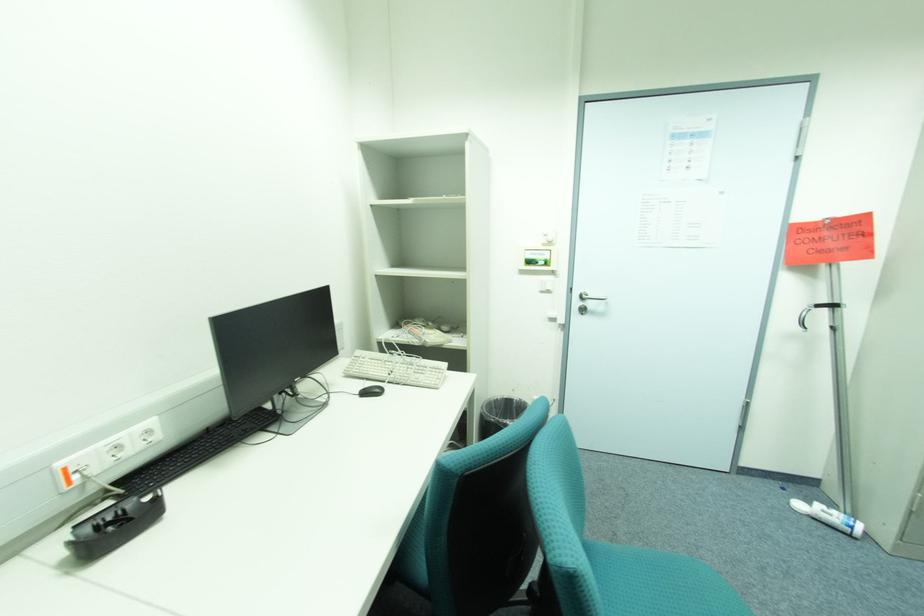
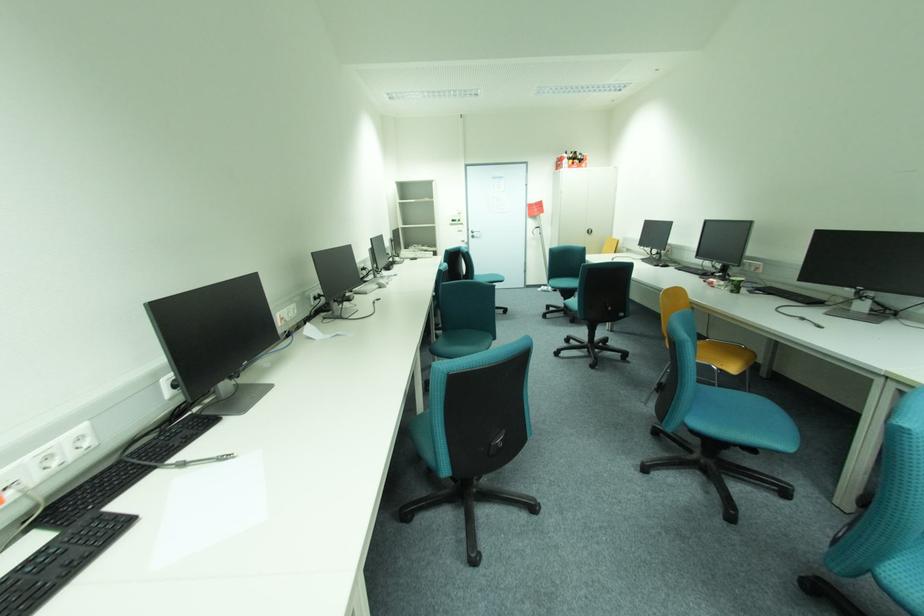
Locate, in the second image, the point that corresponds to point (582, 304) in the first image.

(477, 235)